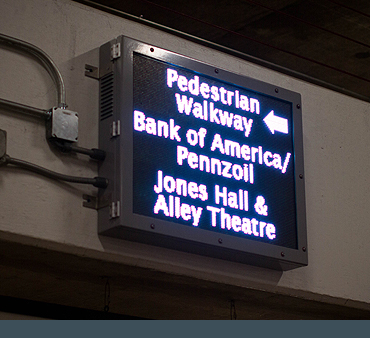
Where is `vent`? The width and height of the screenshot is (370, 338). vent is located at coordinates (105, 103).